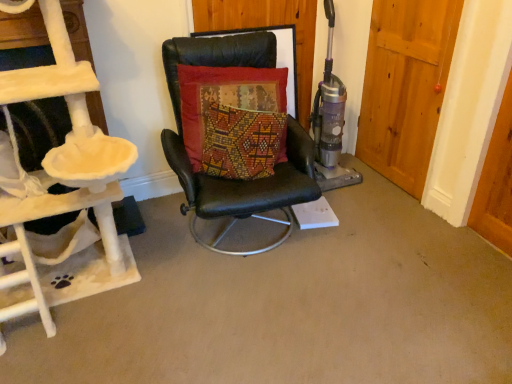
Locate an element on the screen. This screenshot has height=384, width=512. vacant space that is in between black leather chair at center and beige plush cat tree at left is located at coordinates (176, 257).